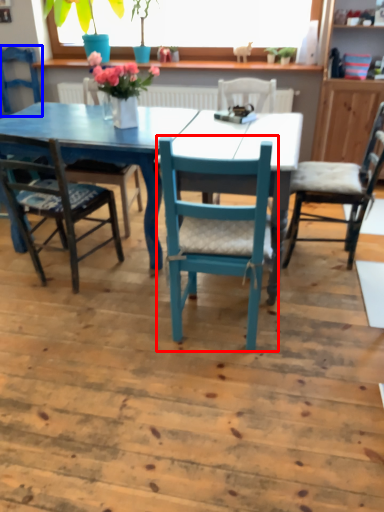
Question: Which object appears farthest to the camera in this image, chair (highlighted by a red box) or chair (highlighted by a blue box)?

Choices:
 (A) chair
 (B) chair

Answer: (B)